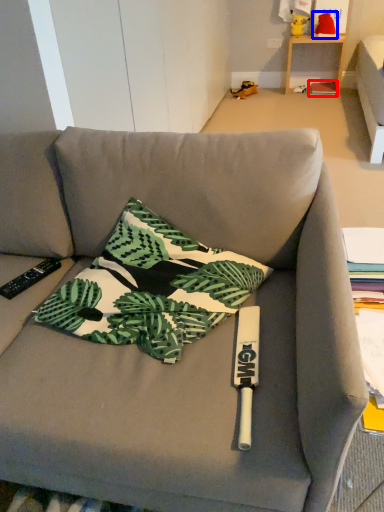
Question: Which of the following is the farthest to the observer, paperback book (highlighted by a red box) or toy (highlighted by a blue box)?

Choices:
 (A) paperback book
 (B) toy

Answer: (A)